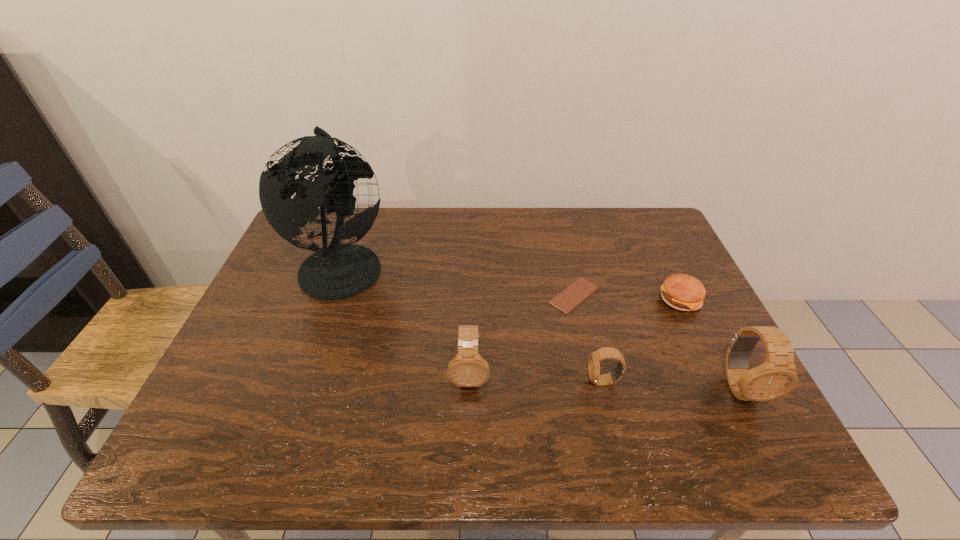
Find the location of a particular element. This screenshot has width=960, height=540. vacant area that satisfies the following two spatial constraints: 1. on the back side of the chocolate bar; 2. on the front-facing side of the tallest object is located at coordinates (567, 265).